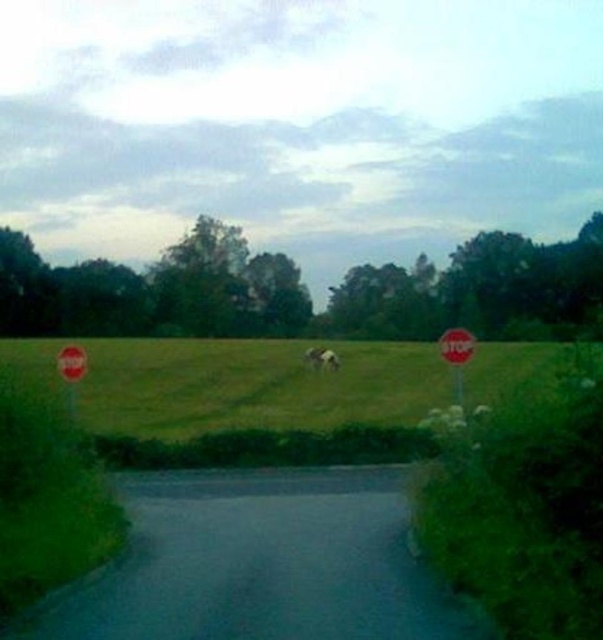
Question: Which of these objects is positioned farthest from the white paper stop sign at right?

Choices:
 (A) green grass at center
 (B) white fluffy cloud at center
 (C) red plastic stop sign at left

Answer: (A)

Question: Is white paper stop sign at right to the left of white fluffy cloud at center from the viewer's perspective?

Choices:
 (A) yes
 (B) no

Answer: (B)

Question: Does green grass at center appear on the left side of red plastic stop sign at left?

Choices:
 (A) no
 (B) yes

Answer: (A)

Question: Which of the following is the closest to the observer?

Choices:
 (A) (335, 362)
 (B) (68, 378)
 (C) (435, 378)
 (D) (464, 353)

Answer: (D)

Question: Which object appears farthest from the camera in this image?

Choices:
 (A) green grass at center
 (B) white paper stop sign at right

Answer: (B)

Question: Is red plastic stop sign at left to the left of white fluffy cloud at center from the viewer's perspective?

Choices:
 (A) no
 (B) yes

Answer: (B)